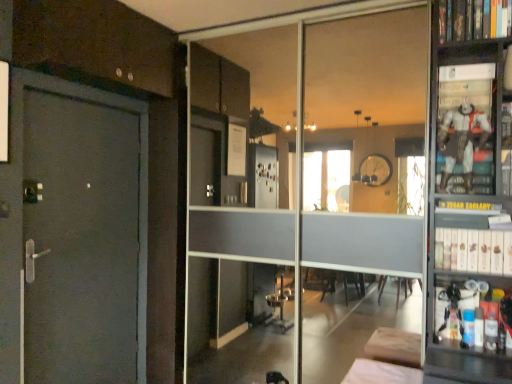
Question: Choose the correct answer: Is transparent glass door at center inside white matte bookshelf at right, which is counted as the 2th book, starting from the top, or outside it?

Choices:
 (A) inside
 (B) outside

Answer: (B)

Question: Is transparent glass door at center taller or shorter than white matte bookshelf at right, which is counted as the 2th book, starting from the top?

Choices:
 (A) short
 (B) tall

Answer: (B)

Question: Which object is positioned farthest from the white fabric bed at lower center?

Choices:
 (A) hardcover book at upper right, the 2th book ordered from the bottom
 (B) metallic figure at right
 (C) white matte bookshelf at right, which is counted as the 2th book, starting from the top
 (D) transparent glass door at center

Answer: (D)

Question: Estimate the real-world distances between objects in this image. Which object is farther from the white fabric bed at lower center?

Choices:
 (A) hardcover book at upper right, the 2th book ordered from the bottom
 (B) transparent glass door at center
 (C) metallic figure at right
 (D) white matte bookshelf at right, which is counted as the 2th book, starting from the top

Answer: (B)